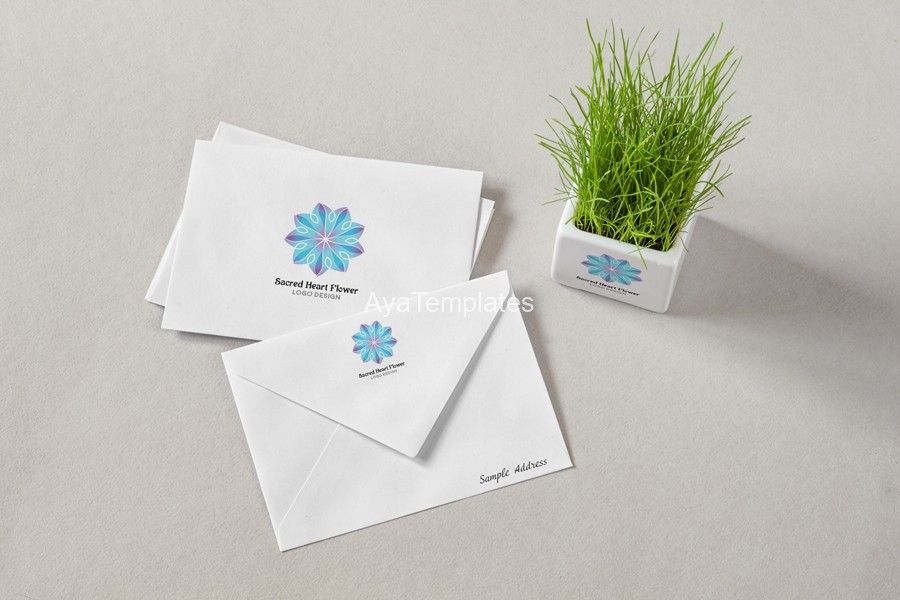
Image resolution: width=900 pixels, height=600 pixels. In order to click on stack of envelopes in this screenshot , I will do `click(480, 237)`.